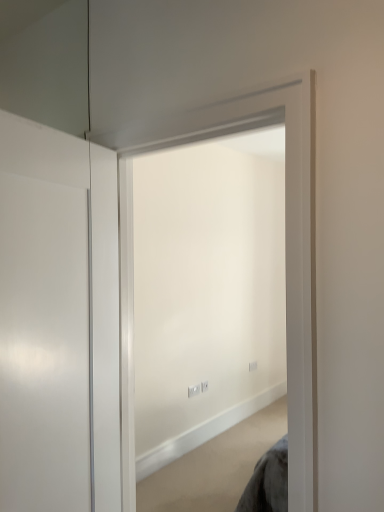
Image resolution: width=384 pixels, height=512 pixels. What do you see at coordinates (207, 290) in the screenshot?
I see `white matte wall at center` at bounding box center [207, 290].

Where is `white matte wall at center`? The image size is (384, 512). white matte wall at center is located at coordinates (207, 290).

What do you see at coordinates (43, 318) in the screenshot?
I see `white glossy door at left` at bounding box center [43, 318].

Locate an element on the screen. white glossy door at left is located at coordinates (43, 318).

You are a GUI agent. You are given a task and a screenshot of the screen. Output one action in this format:
    pyautogui.click(x=<x>, y=<y>)
    Task: Click on the white matte wall at center
    The height and width of the screenshot is (512, 384).
    Given the screenshot: What is the action you would take?
    pyautogui.click(x=207, y=290)

Would you say white glossy door at left is to the left or to the right of white matte wall at center in the picture?

Based on their positions, white glossy door at left is located to the left of white matte wall at center.

Which object is more forward, white glossy door at left or white matte wall at center?

white glossy door at left is more forward.

Considering the points (51, 338) and (279, 236), which point is in front, point (51, 338) or point (279, 236)?

Point (51, 338)

From the image's perspective, would you say white glossy door at left is shown under white matte wall at center?

Yes.

From a real-world perspective, between white glossy door at left and white matte wall at center, who is vertically higher?

From a 3D spatial view, white glossy door at left is above.

Consider the image. Considering the sizes of white glossy door at left and white matte wall at center in the image, is white glossy door at left wider or thinner than white matte wall at center?

Considering their sizes, white glossy door at left looks slimmer than white matte wall at center.

Who is taller, white glossy door at left or white matte wall at center?

With more height is white matte wall at center.

Can you confirm if white glossy door at left is smaller than white matte wall at center?

Correct, white glossy door at left occupies less space than white matte wall at center.

Is white matte wall at center located within white glossy door at left?

That's incorrect, white matte wall at center is not inside white glossy door at left.

Are white glossy door at left and white matte wall at center making contact?

white glossy door at left and white matte wall at center are not in contact.

Is white glossy door at left turned away from white matte wall at center?

No, white matte wall at center is not at the back of white glossy door at left.

The image size is (384, 512). Find the location of `window located behind the white glossy door at left`. window located behind the white glossy door at left is located at coordinates (207, 290).

From the picture: Considering the relative positions of white matte wall at center and white glossy door at left in the image provided, is white matte wall at center to the left or to the right of white glossy door at left?

Clearly, white matte wall at center is on the right of white glossy door at left in the image.

Considering the positions of objects white matte wall at center and white glossy door at left in the image provided, who is behind, white matte wall at center or white glossy door at left?

white matte wall at center is more distant.

Which is in front, point (250, 233) or point (5, 449)?

The point (5, 449) is closer to the camera.

Looking at this image, from the image's perspective, which one is positioned higher, white matte wall at center or white glossy door at left?

white matte wall at center is shown above in the image.

From a real-world perspective, is white matte wall at center on top of white glossy door at left?

No, from a real-world perspective, white matte wall at center is not on top of white glossy door at left.

In terms of width, does white matte wall at center look wider or thinner when compared to white glossy door at left?

white matte wall at center is wider than white glossy door at left.

Considering the relative sizes of white matte wall at center and white glossy door at left in the image provided, is white matte wall at center shorter than white glossy door at left?

No, white matte wall at center is not shorter than white glossy door at left.

Looking at this image, in terms of size, does white matte wall at center appear bigger or smaller than white glossy door at left?

In the image, white matte wall at center appears to be larger than white glossy door at left.

Is white matte wall at center not inside white glossy door at left?

Yes, white matte wall at center is outside of white glossy door at left.

Based on the photo, are white matte wall at center and white glossy door at left making contact?

No, white matte wall at center is not making contact with white glossy door at left.

Is white matte wall at center aimed at white glossy door at left?

Yes, white matte wall at center faces towards white glossy door at left.

How many degrees apart are the facing directions of white matte wall at center and white glossy door at left?

The angle between the facing direction of white matte wall at center and the facing direction of white glossy door at left is 104 degrees.

Identify the location of window on the right of the white glossy door at left. (207, 290).

Find the location of a particular element. This screenshot has height=512, width=384. door located on the left of white matte wall at center is located at coordinates (43, 318).

The width and height of the screenshot is (384, 512). I want to click on window that appears on the right of white glossy door at left, so point(207,290).